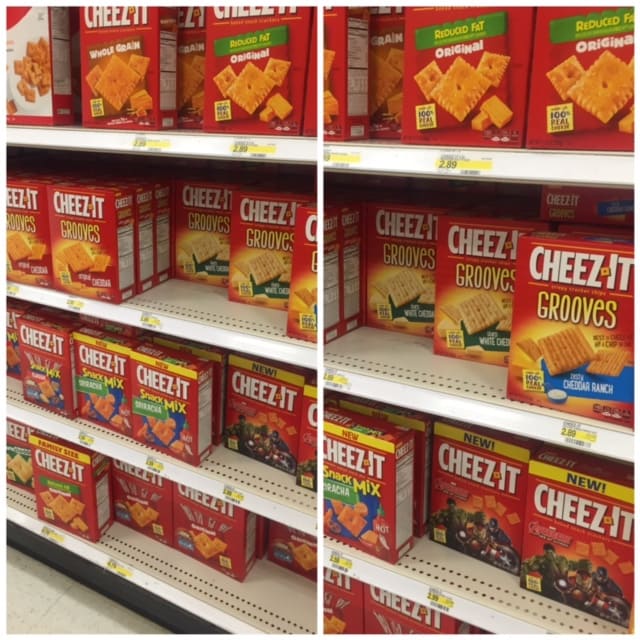
The height and width of the screenshot is (640, 640). Identify the location of shelves. point(275,141), point(252,339), point(275,516), point(235,625), point(546,166), point(443,397), point(495,621).